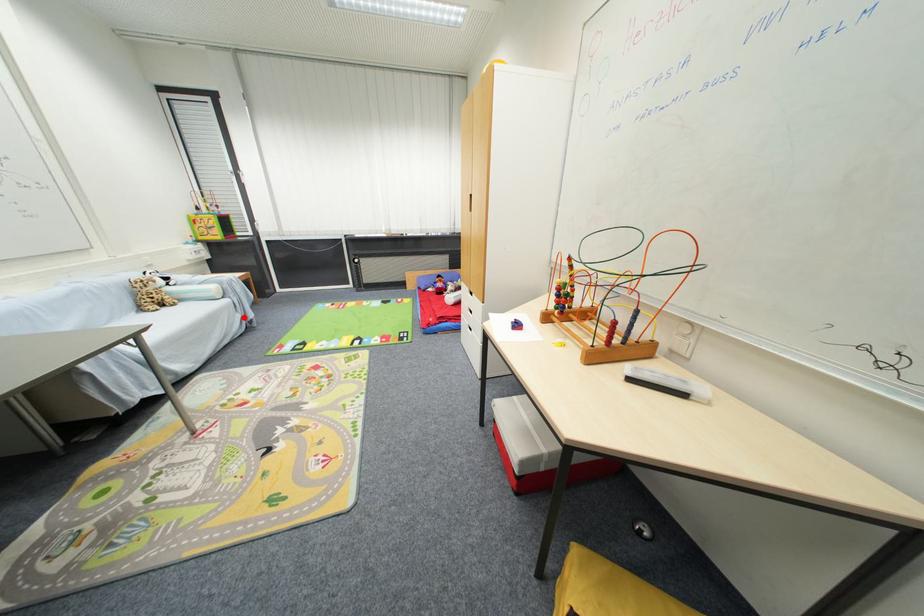
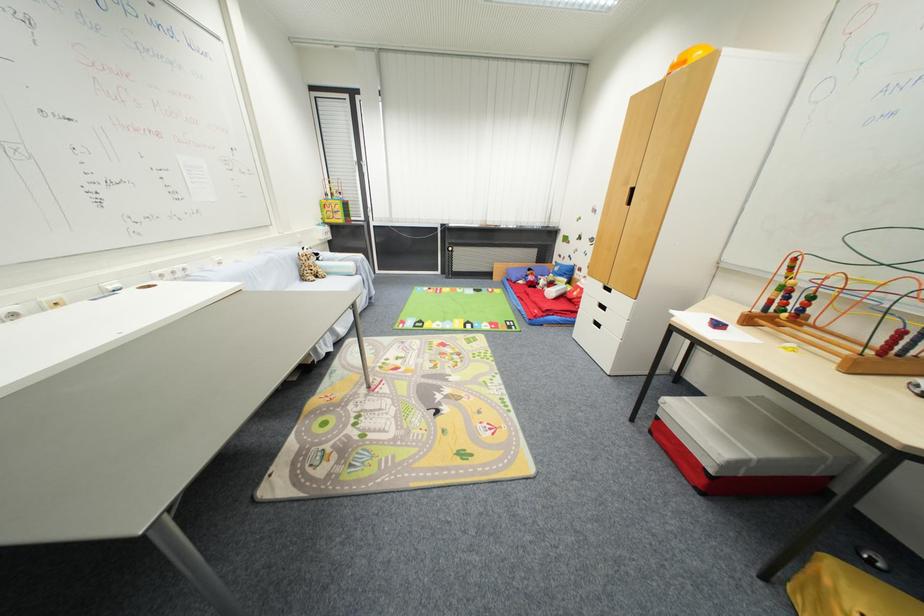
Question: I am providing you with two images of the same scene from different viewpoints. Given a red point in image1, look at the same physical point in image2. Is it:

Choices:
 (A) Closer to the viewpoint
 (B) Farther from the viewpoint

Answer: (B)